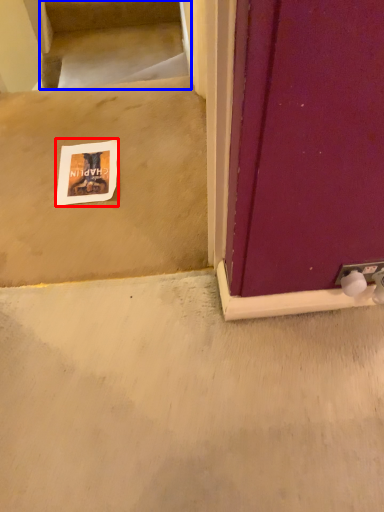
Question: Which object is closer to the camera taking this photo, postcard (highlighted by a red box) or stairwell (highlighted by a blue box)?

Choices:
 (A) postcard
 (B) stairwell

Answer: (A)